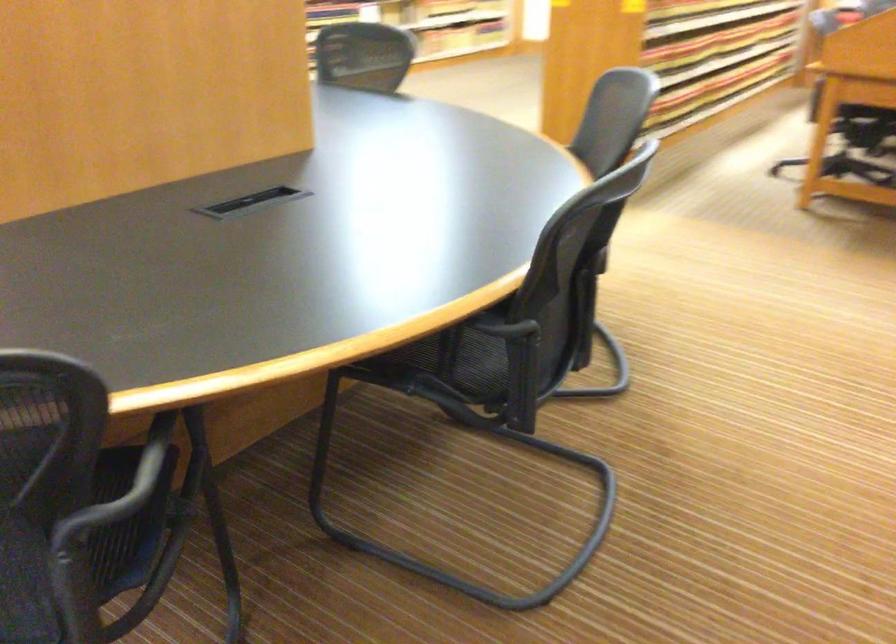
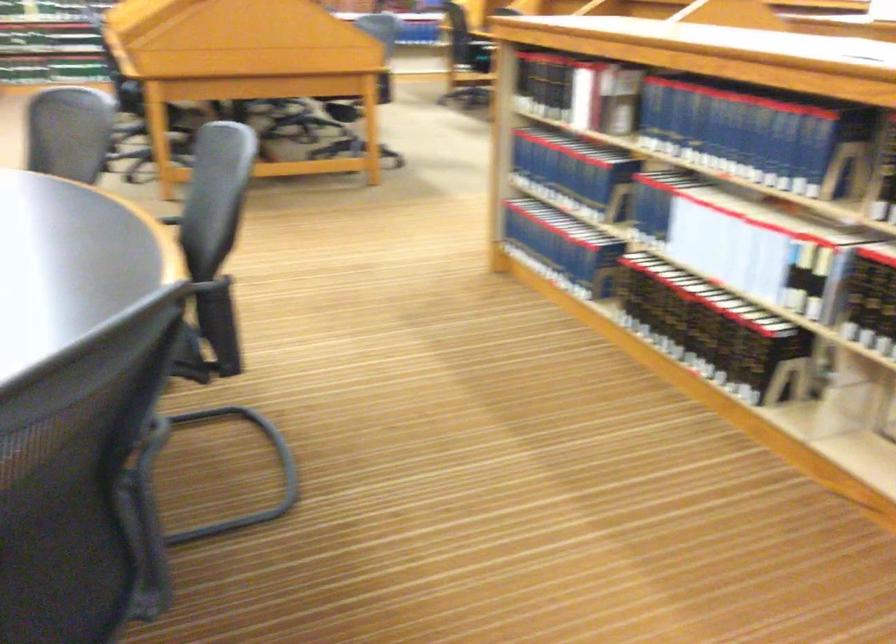
Question: I am providing you with two images of the same scene from different viewpoints. Please identify which objects are invisible in image2.

Choices:
 (A) chair armrest
 (B) black selector switch
 (C) blue book
 (D) black book

Answer: (A)